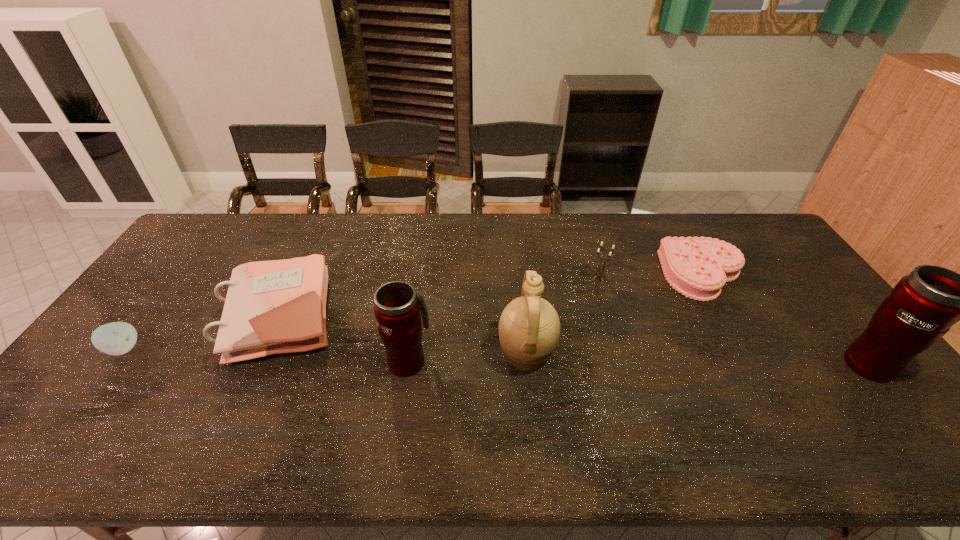
Image resolution: width=960 pixels, height=540 pixels. I want to click on apple, so click(x=116, y=338).

You are a GUI agent. You are given a task and a screenshot of the screen. Output one action in this format:
    pyautogui.click(x=<x>, y=<y>)
    Task: Click on the free space located 0.080m on the side with the handle of the left thermos bottle
    
    Given the screenshot: What is the action you would take?
    pyautogui.click(x=415, y=321)

Where is `free space located 0.050m on the side with the handle of the left thermos bottle`? The height and width of the screenshot is (540, 960). free space located 0.050m on the side with the handle of the left thermos bottle is located at coordinates (414, 329).

Where is `free spot located on the side with the handle of the left thermos bottle`? Image resolution: width=960 pixels, height=540 pixels. free spot located on the side with the handle of the left thermos bottle is located at coordinates [x=420, y=290].

You are a GUI agent. You are given a task and a screenshot of the screen. Output one action in this format:
    pyautogui.click(x=<x>, y=<y>)
    Task: Click on the vacant space located on the side with the handle of the taller thermos bottle
    
    Given the screenshot: What is the action you would take?
    pyautogui.click(x=830, y=315)

Locate an element on the screen. Image resolution: width=960 pixels, height=540 pixels. blank space located on the side with the handle of the taller thermos bottle is located at coordinates (811, 291).

The image size is (960, 540). Identify the location of vacant region located on the side with the handle of the taller thermos bottle. (785, 259).

Image resolution: width=960 pixels, height=540 pixels. Find the location of `vacant space positioned on the right of the candle holder`. vacant space positioned on the right of the candle holder is located at coordinates (628, 278).

Where is `vacant region located on the front of the second object from left to right`? The image size is (960, 540). vacant region located on the front of the second object from left to right is located at coordinates (244, 389).

Where is `free space located 0.220m on the left of the pitcher`? Image resolution: width=960 pixels, height=540 pixels. free space located 0.220m on the left of the pitcher is located at coordinates (416, 353).